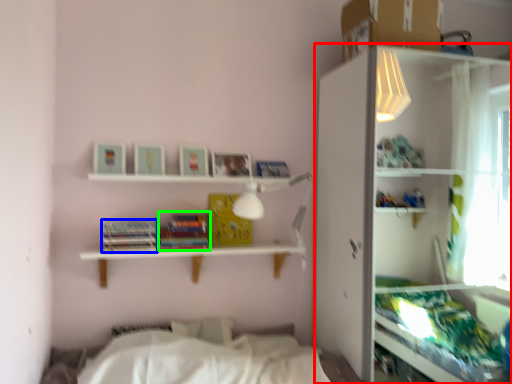
Question: Which object is positioned farthest from shelf (highlighted by a red box)? Select from paperback book (highlighted by a blue box) and paperback book (highlighted by a green box).

Choices:
 (A) paperback book
 (B) paperback book

Answer: (A)